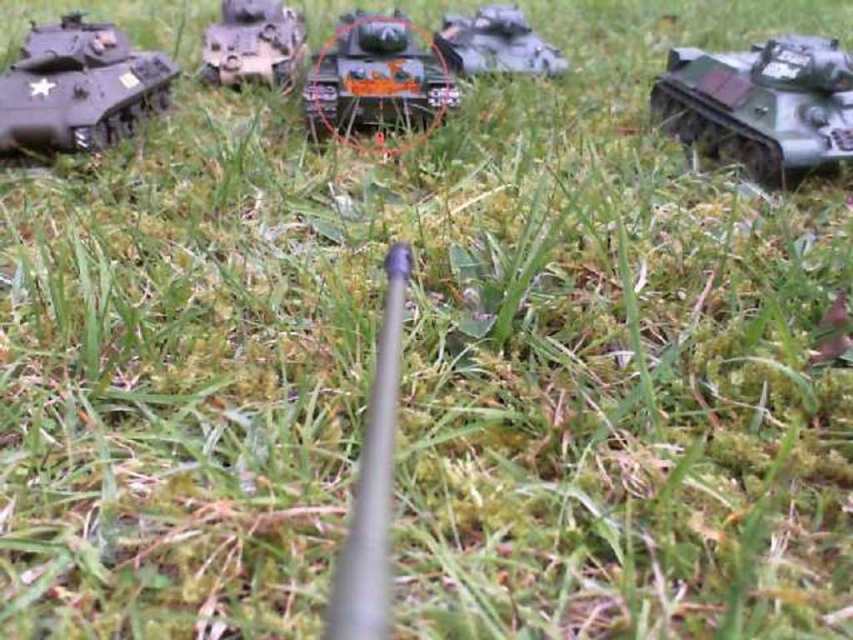
Who is more forward, (x=126, y=86) or (x=538, y=72)?

Positioned in front is point (x=126, y=86).

Which is behind, point (125, 116) or point (549, 70)?

The point (549, 70) is more distant.

The height and width of the screenshot is (640, 853). In order to click on matte black tank at left in this screenshot , I will do `click(78, 88)`.

Is point (717, 93) positioned before point (73, 104)?

No, it is behind (73, 104).

Is camouflage plastic tank at right shorter than matte black tank at left?

Correct, camouflage plastic tank at right is not as tall as matte black tank at left.

Does point (782, 161) lie in front of point (115, 28)?

Yes, point (782, 161) is in front of point (115, 28).

Where is `camouflage plastic tank at right`? The image size is (853, 640). camouflage plastic tank at right is located at coordinates (761, 104).

Which is below, shiny orange tank at center or green matte tank at center?

shiny orange tank at center is below.

Who is more distant from viewer, [422,58] or [486,19]?

The point [486,19] is more distant.

Identify the location of shiny orange tank at center. (378, 77).

The width and height of the screenshot is (853, 640). Identify the location of shiny orange tank at center. (378, 77).